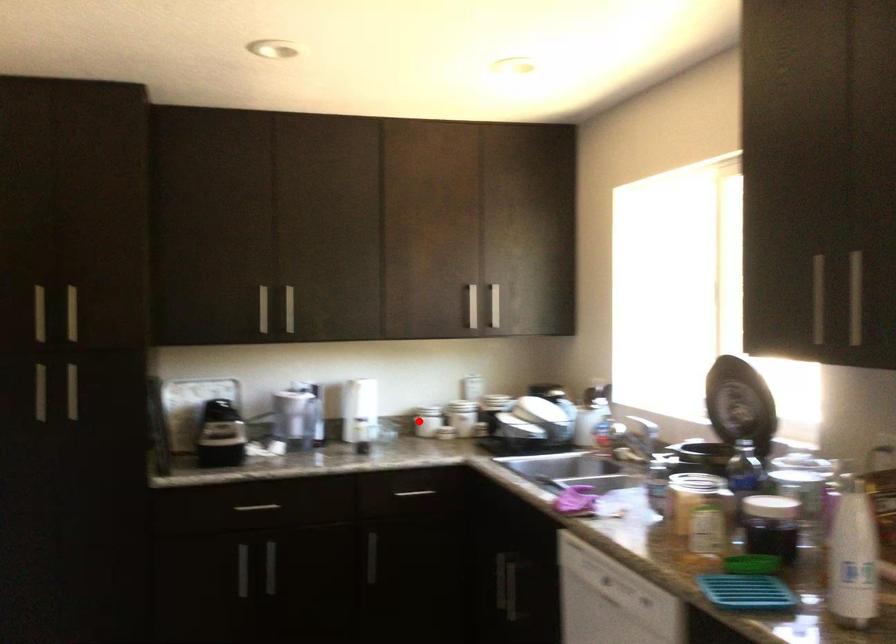
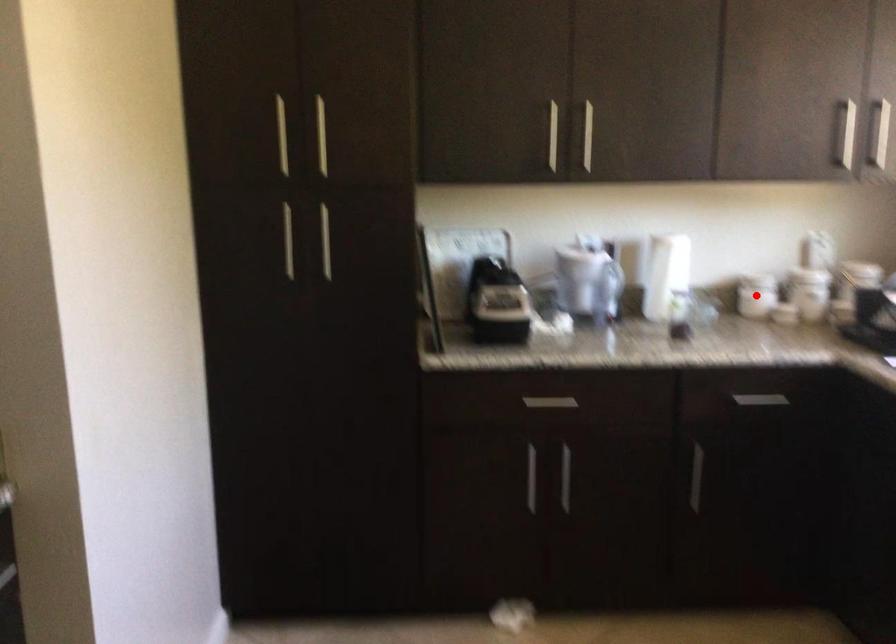
I am providing you with two images of the same scene from different viewpoints. A red point is marked on the first image and another point is marked on the second image. Are the points marked in image1 and image2 representing the same 3D position?

Yes